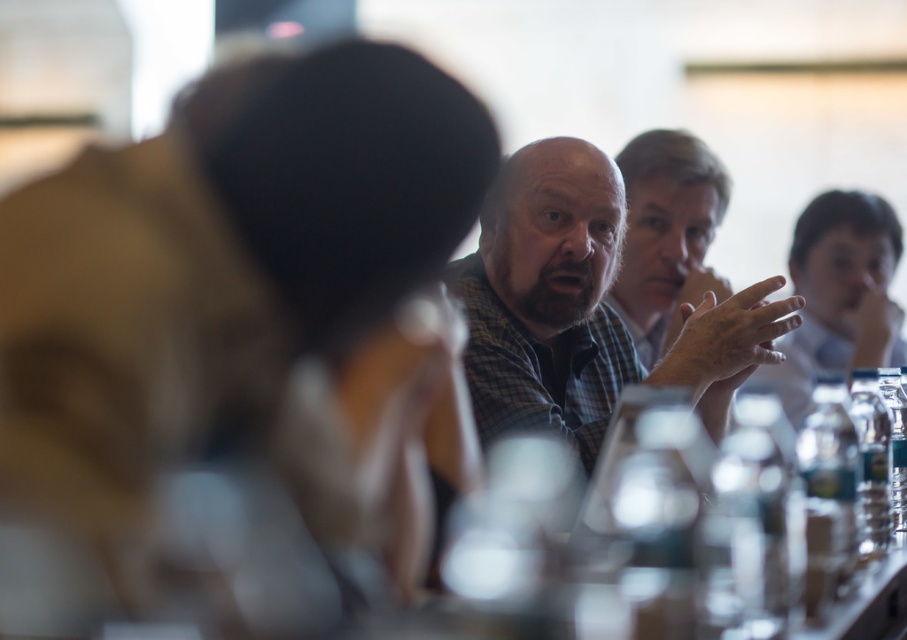
Is point (691, 387) in front of point (652, 136)?

Yes, it is.

Can you confirm if plaid shirt at center is taller than checkered fabric shirt at center?

No, plaid shirt at center is not taller than checkered fabric shirt at center.

Is point (517, 225) less distant than point (705, 202)?

Yes, point (517, 225) is in front of point (705, 202).

The height and width of the screenshot is (640, 907). I want to click on plaid shirt at center, so click(x=583, y=307).